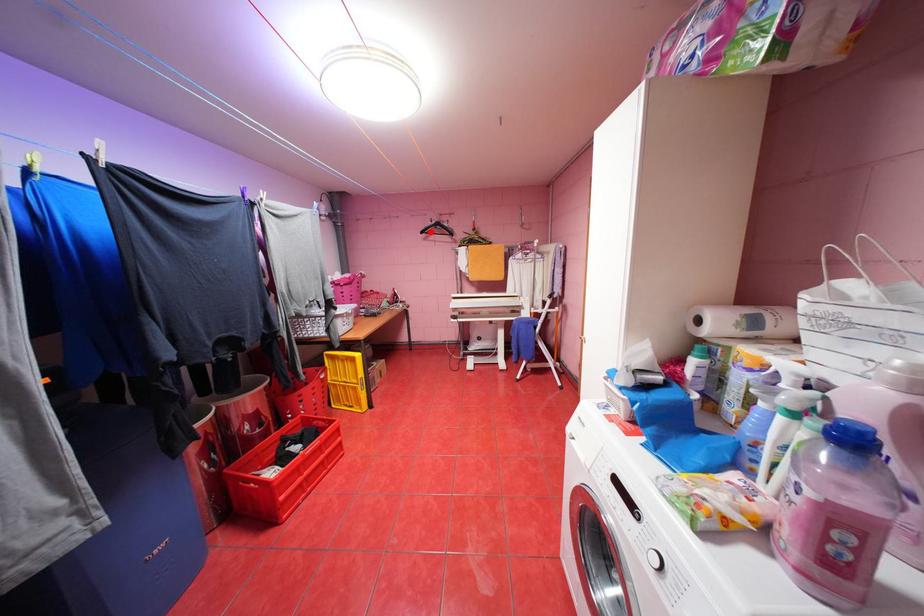
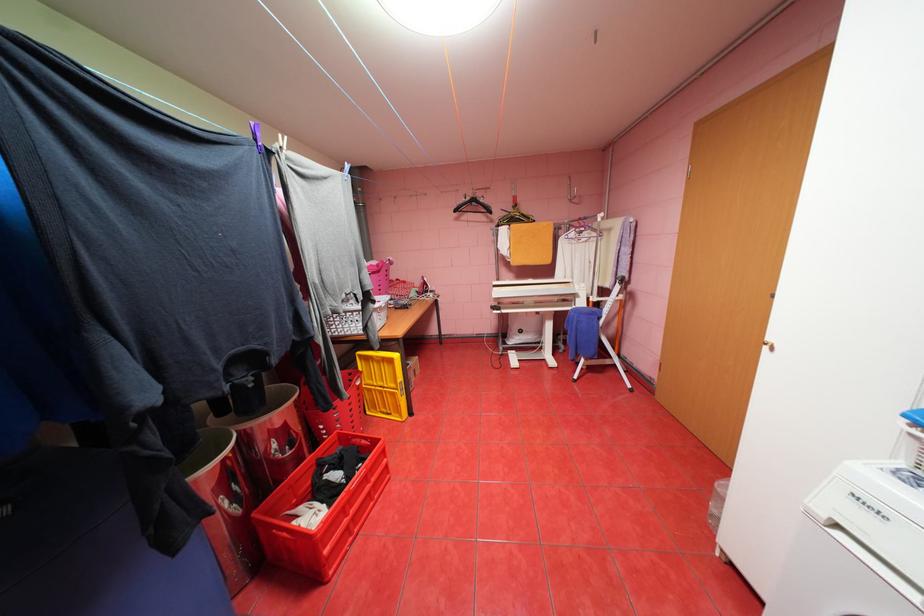
Question: I am providing you with two images of the same scene from different viewpoints. A red point is marked on the first image. Can you still see the location of the red point in image 2?

Choices:
 (A) Yes
 (B) No

Answer: (A)